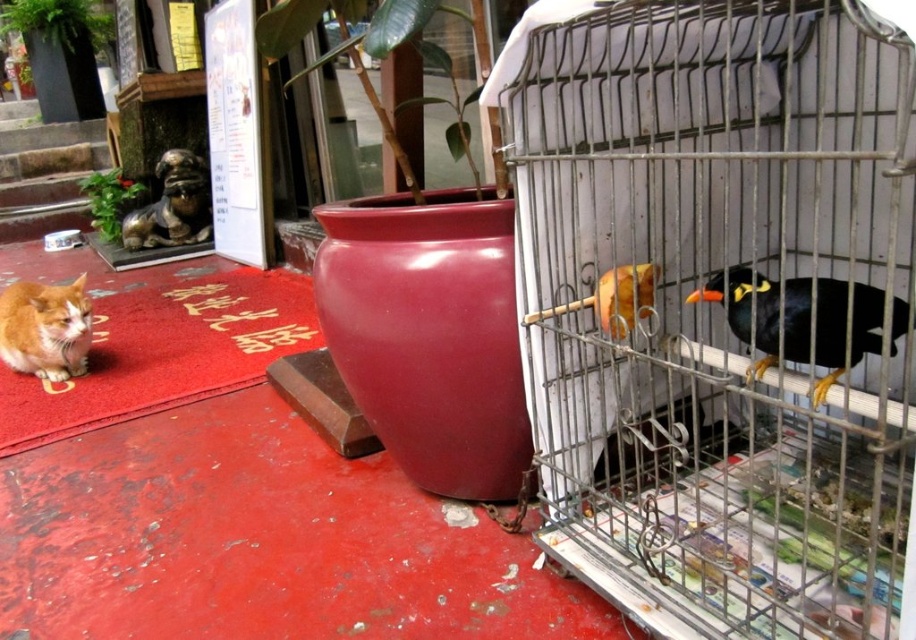
You are a photographer standing in front of the scene. You want to take a photo that includes both the black glossy bird at right and the orange fur cat at left. Which object should you focus on first to ensure both are in sharp focus?

You should focus on the orange fur cat at left first because the black glossy bird at right is closer to the viewer than the orange fur cat at left, so focusing on the farther object first might help in achieving depth of field for both.

You are a delivery person who needs to place a small package between the metallic wire birdcage at right and the orange fur cat at left. Based on their positions, which object is nearer to you to ensure the package is placed correctly?

The metallic wire birdcage at right is closer to the viewer than the orange fur cat at left, so place the package near the metallic wire birdcage at right to ensure it is positioned correctly between them.

You are standing at the point marked as point (718, 307). What object is located to your right?

The metallic wire birdcage at right is located to your right.